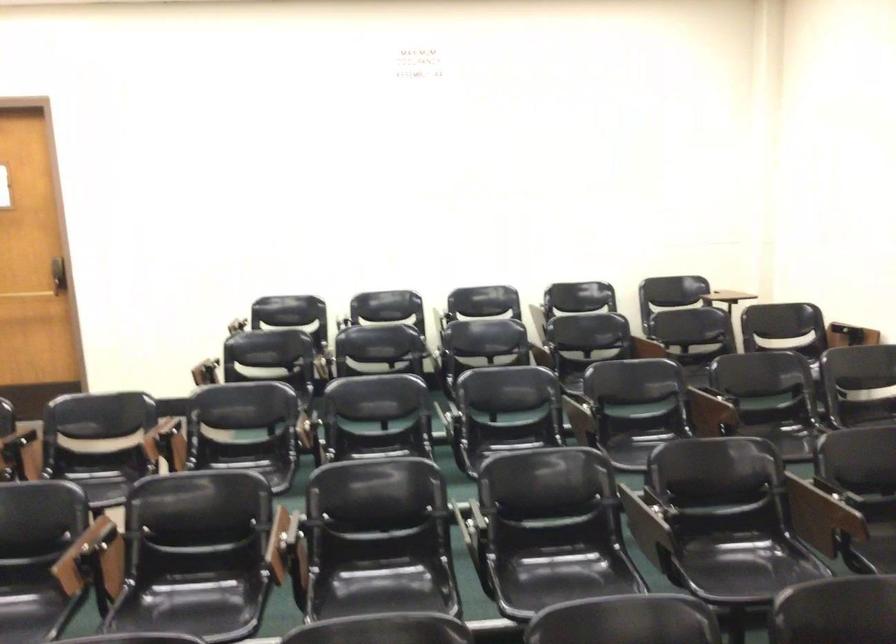
The width and height of the screenshot is (896, 644). I want to click on door handle, so click(x=58, y=275).